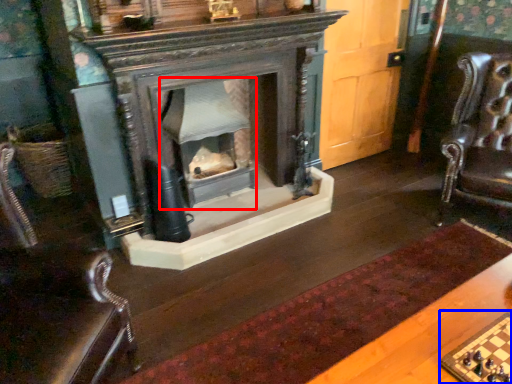
Question: Which object appears closest to the camera in this image, fireplace (highlighted by a red box) or board game (highlighted by a blue box)?

Choices:
 (A) fireplace
 (B) board game

Answer: (B)